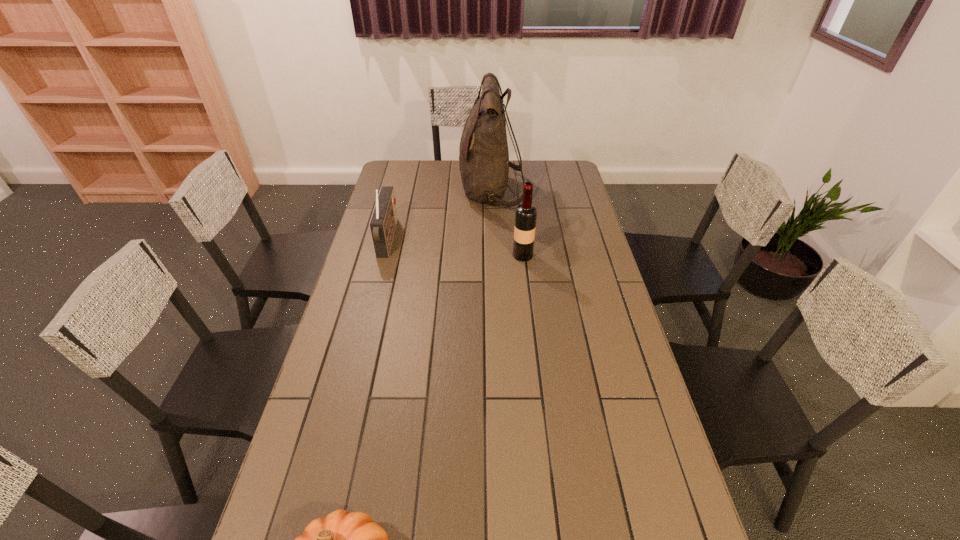
Locate an element on the screen. object present at the left edge is located at coordinates (383, 222).

In the image, there is a desktop. At what (x,y) coordinates should I click in order to perform the action: click on vacant region at the far edge. Please return your answer as a coordinate pair (x, y). Looking at the image, I should click on (460, 176).

Identify the location of vacant space at the left edge. The height and width of the screenshot is (540, 960). (396, 267).

Image resolution: width=960 pixels, height=540 pixels. I want to click on vacant space at the right edge of the desktop, so click(639, 410).

Find the location of a particular element. blank region between the wine bottle and the backpack is located at coordinates (507, 223).

This screenshot has height=540, width=960. What are the coordinates of `vacant point located between the wine bottle and the backpack` in the screenshot? It's located at (507, 223).

Locate an element on the screen. free space between the farthest object and the wine bottle is located at coordinates (507, 223).

You are a GUI agent. You are given a task and a screenshot of the screen. Output one action in this format:
    pyautogui.click(x=<x>, y=<y>)
    Task: Click on the vacant space that's between the third tallest object and the farthest object
    The width and height of the screenshot is (960, 540).
    Given the screenshot: What is the action you would take?
    pyautogui.click(x=440, y=215)

This screenshot has width=960, height=540. Find the location of `object identified as the second closest to the third shortest object`. object identified as the second closest to the third shortest object is located at coordinates (383, 222).

At what (x,y) coordinates should I click in order to perform the action: click on the second closest object to the tallest object. Please return your answer as a coordinate pair (x, y). Looking at the image, I should click on (383, 222).